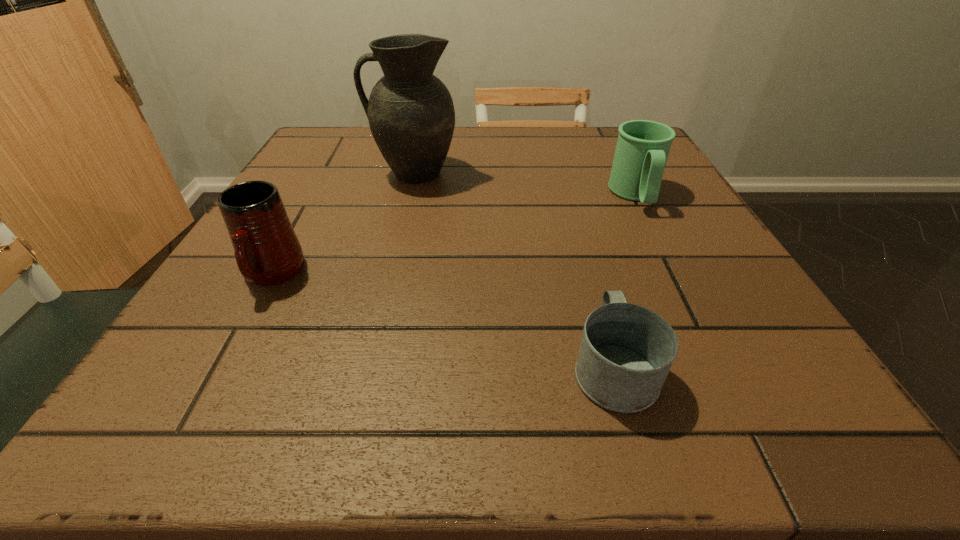
Image resolution: width=960 pixels, height=540 pixels. Identify the location of vacant region that satisfies the following two spatial constraints: 1. on the side of the pitcher with the handle; 2. on the side of the leftmost mug with the handle. pos(390,275).

Locate an element on the screen. The image size is (960, 540). free location that satisfies the following two spatial constraints: 1. on the side of the third object from left to right with the handle; 2. on the side of the pitcher with the handle is located at coordinates click(559, 173).